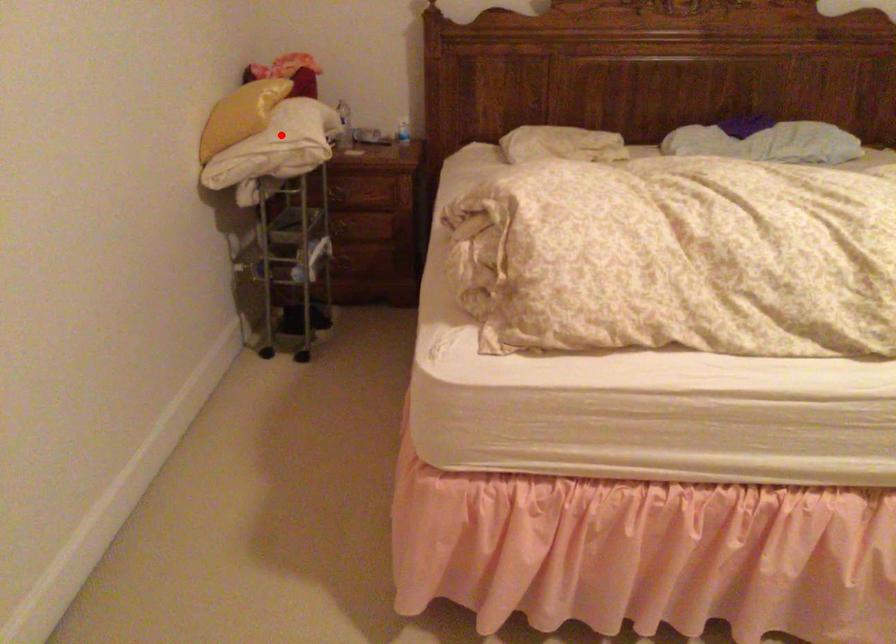
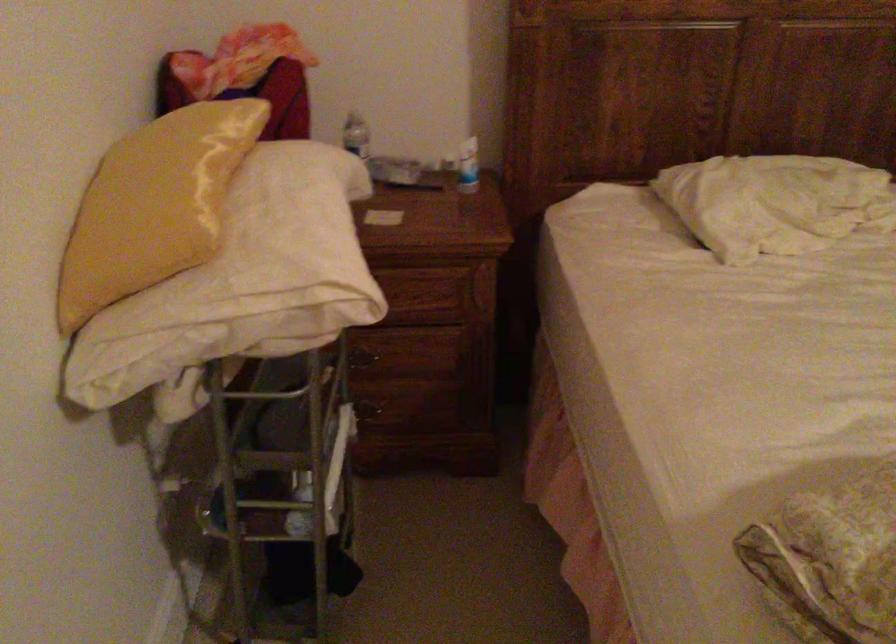
In the second image, find the point that corresponds to the highlighted location in the first image.

(254, 272)